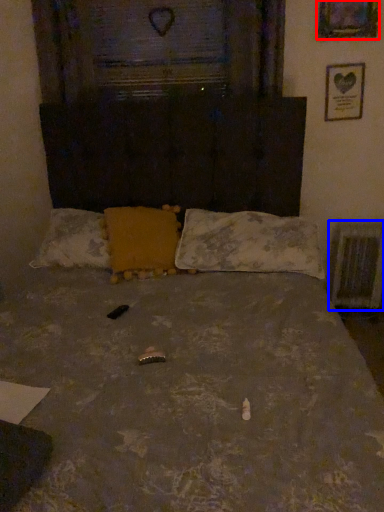
Question: Which of the following is the closest to the observer, picture frame (highlighted by a red box) or radiator (highlighted by a blue box)?

Choices:
 (A) picture frame
 (B) radiator

Answer: (A)